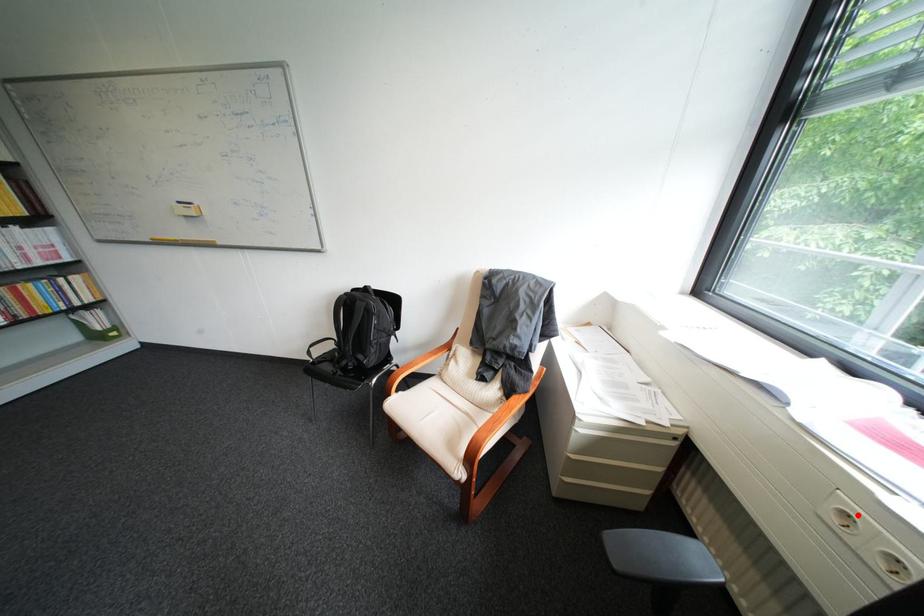
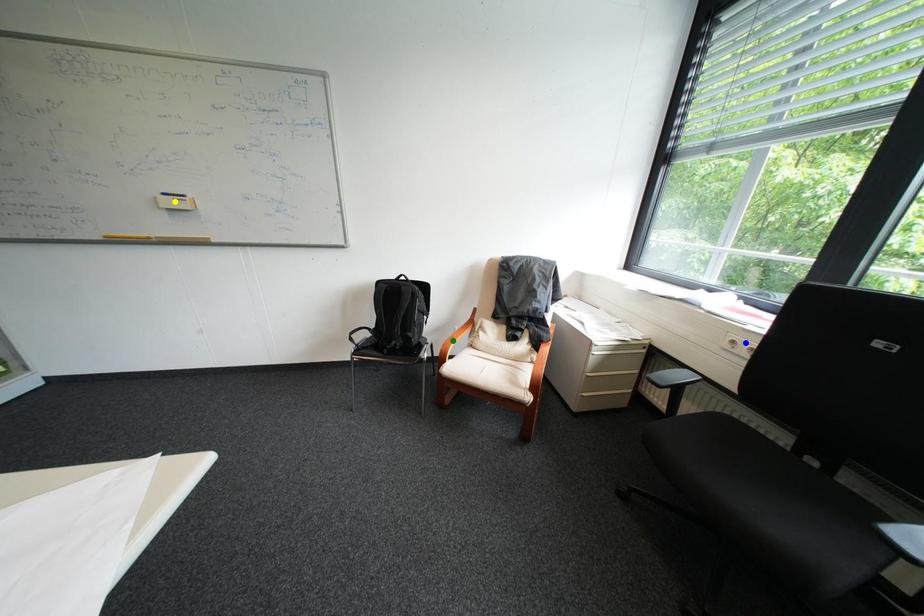
Question: I am providing you with two images of the same scene from different viewpoints. A red point is marked on the first image. You are given multiple points on the second image. Can you choose the point in image 2 that corresponds to the point in image 1?

Choices:
 (A) yellow point
 (B) blue point
 (C) green point

Answer: (B)